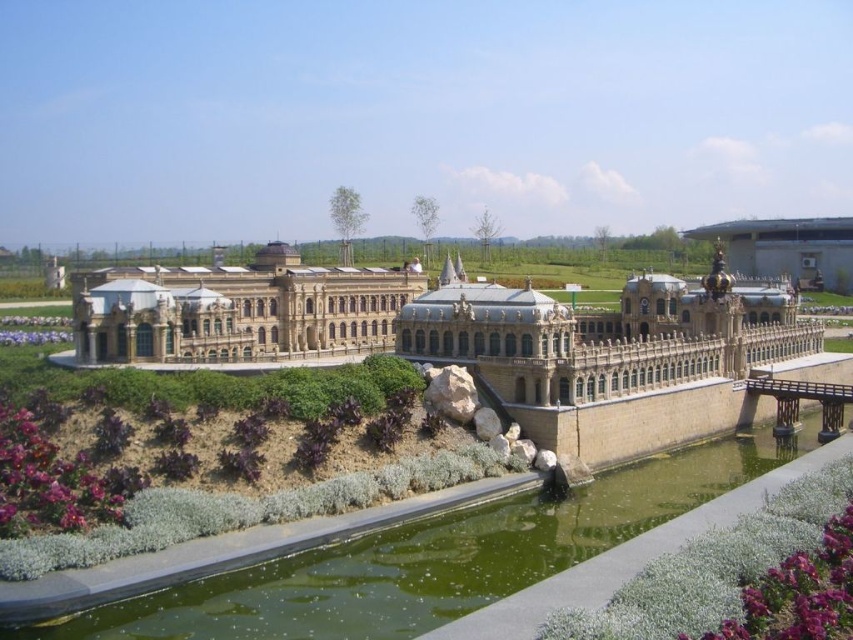
Question: Where is greenish water at lower center located in relation to golden stone palace at center in the image?

Choices:
 (A) below
 (B) above

Answer: (A)

Question: Among these points, which one is farthest from the camera?

Choices:
 (A) (376, 584)
 (B) (126, 282)

Answer: (B)

Question: Can you confirm if greenish water at lower center is wider than golden stone palace at center?

Choices:
 (A) no
 (B) yes

Answer: (B)

Question: Which point appears farthest from the camera in this image?

Choices:
 (A) (379, 320)
 (B) (379, 573)

Answer: (A)

Question: Can you confirm if greenish water at lower center is positioned below golden stone palace at center?

Choices:
 (A) yes
 (B) no

Answer: (A)